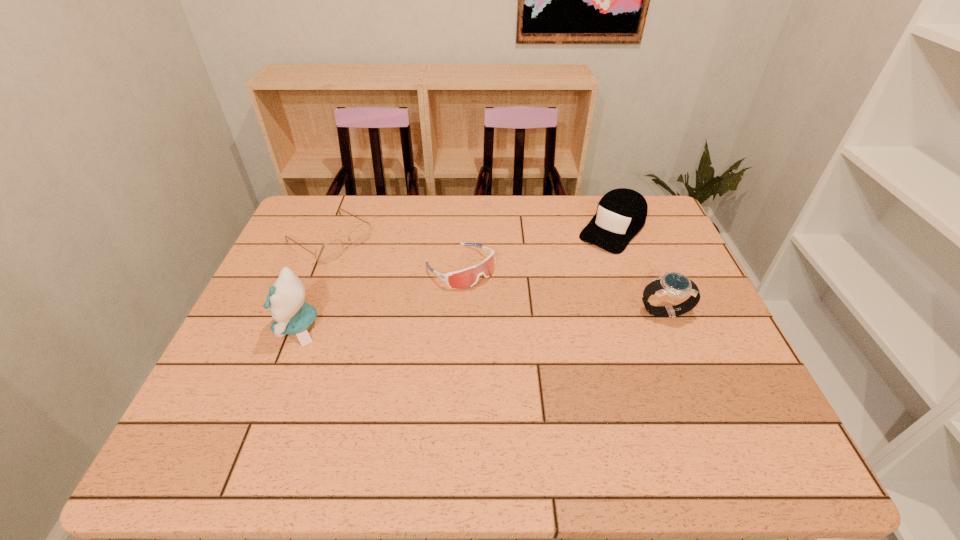
Locate an element on the screen. The image size is (960, 540). vacant space on the desktop that is between the kitten and the watch and is positioned on the front-facing side of the cap is located at coordinates (533, 317).

At what (x,y) coordinates should I click in order to perform the action: click on vacant spot on the desktop that is between the kitten and the watch and is positioned on the front-facing side of the third object from right to left. Please return your answer as a coordinate pair (x, y). Looking at the image, I should click on (517, 318).

Image resolution: width=960 pixels, height=540 pixels. I want to click on free spot on the desktop that is between the tallest object and the watch and is positioned on the front-facing side of the shortest object, so click(x=451, y=320).